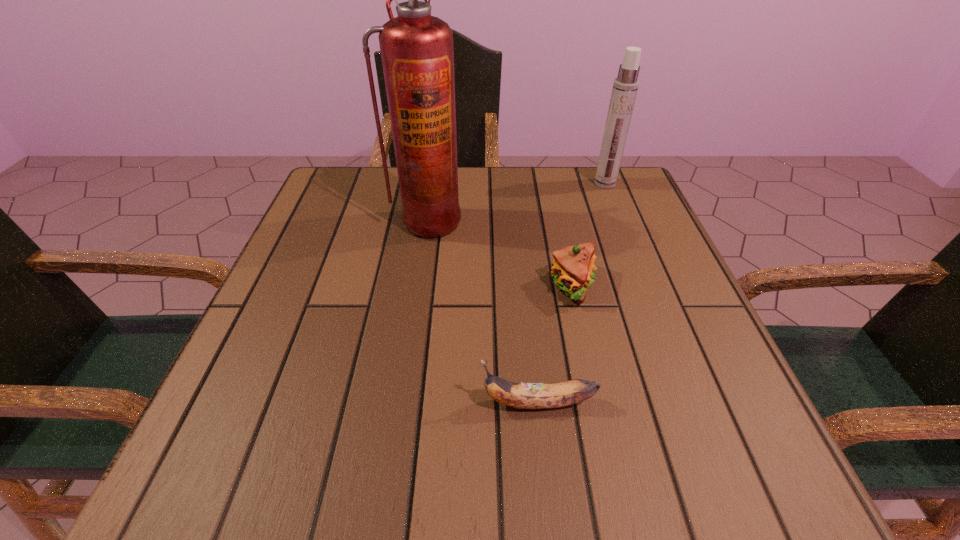
At what (x,y) coordinates should I click in order to perform the action: click on fire extinguisher. Please return your answer as a coordinate pair (x, y). This screenshot has height=540, width=960. Looking at the image, I should click on (417, 52).

This screenshot has height=540, width=960. In order to click on the leftmost object in this screenshot , I will do tap(417, 52).

Identify the location of aerosol can. (625, 86).

Locate an element on the screen. The height and width of the screenshot is (540, 960). the second tallest object is located at coordinates (625, 86).

Identify the location of the second nearest object. The width and height of the screenshot is (960, 540). (573, 266).

This screenshot has width=960, height=540. In order to click on banana in this screenshot , I will do `click(517, 395)`.

Identify the location of free space located on the side of the fire extinguisher with the label. (420, 275).

Identify the location of vacant point located on the left of the aerosol can. (575, 184).

Where is `vacant region located on the left of the second nearest object`? This screenshot has width=960, height=540. vacant region located on the left of the second nearest object is located at coordinates (471, 286).

This screenshot has width=960, height=540. I want to click on vacant space located 0.390m on the peel of the banana, so click(x=223, y=403).